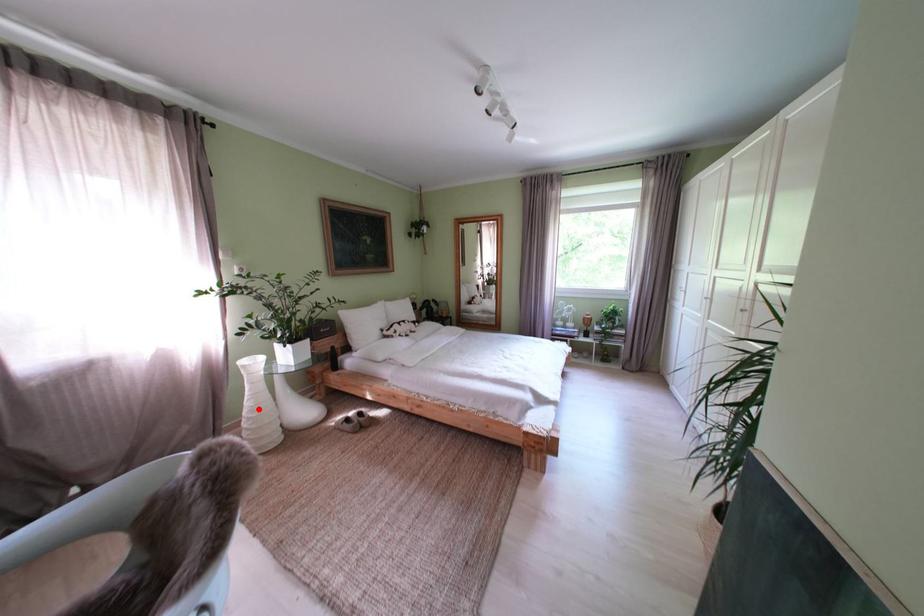
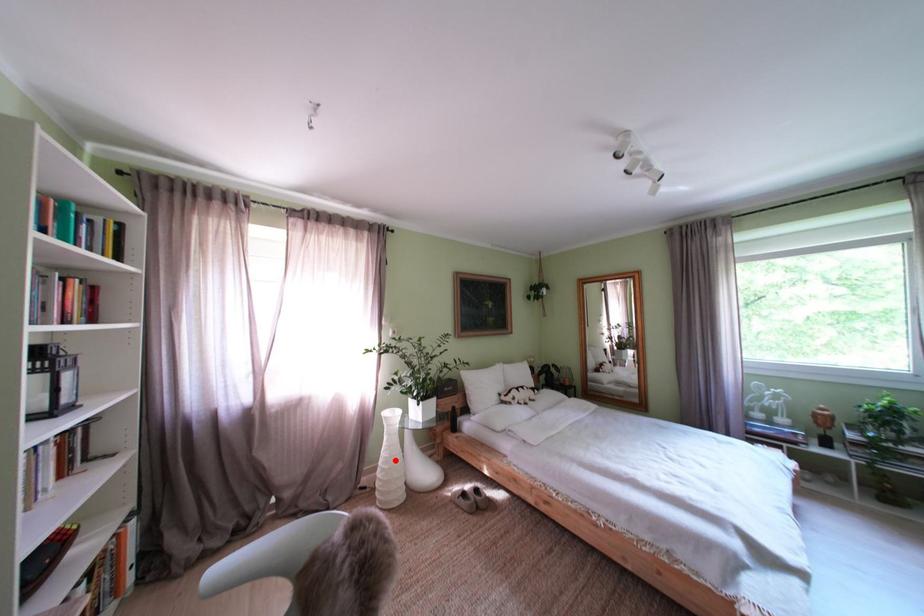
I am providing you with two images of the same scene from different viewpoints. A red point is marked on the first image and another point is marked on the second image. Is the red point in image1 aligned with the point shown in image2?

Yes